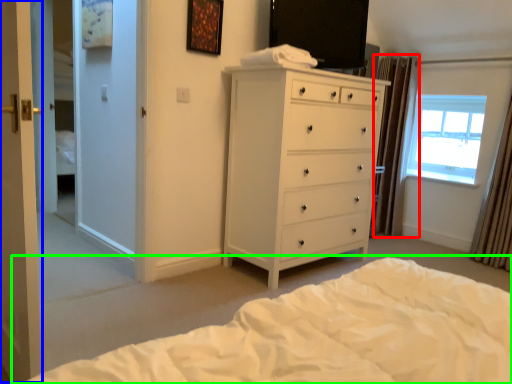
Question: Which is nearer to the curtain (highlighted by a red box)? screen door (highlighted by a blue box) or bed (highlighted by a green box).

Choices:
 (A) screen door
 (B) bed

Answer: (B)